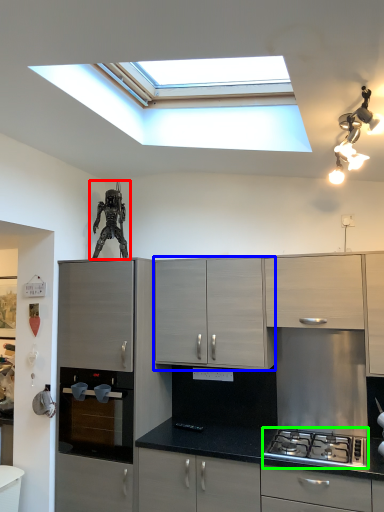
Question: Considering the real-world distances, which object is closest to sculpture (highlighted by a red box)? cabinetry (highlighted by a blue box) or gas stove (highlighted by a green box).

Choices:
 (A) cabinetry
 (B) gas stove

Answer: (A)